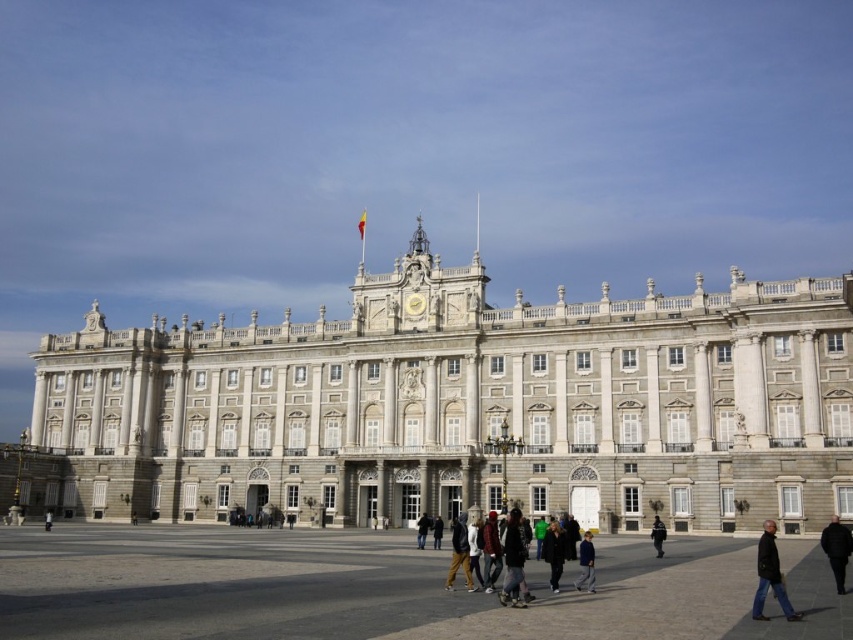
Question: Among these points, which one is nearest to the camera?

Choices:
 (A) (231, 397)
 (B) (757, 561)

Answer: (B)

Question: Can you confirm if gray concrete plaza at lower center is positioned to the left of dark blue jacket at center?

Choices:
 (A) no
 (B) yes

Answer: (B)

Question: Does light blue denim jacket at center have a greater width compared to dark blue uniform at center?

Choices:
 (A) yes
 (B) no

Answer: (A)

Question: Is the position of brown cotton pants at center less distant than that of light blue denim jacket at center?

Choices:
 (A) no
 (B) yes

Answer: (A)

Question: Which is nearer to the black leather jacket at lower right?

Choices:
 (A) dark blue uniform at center
 (B) white stone building at center
 (C) gray concrete plaza at lower center

Answer: (A)

Question: Which of the following is the closest to the observer?

Choices:
 (A) dark gray hoodie at center
 (B) gray concrete plaza at lower center
 (C) brown cotton pants at center
 (D) white stone building at center

Answer: (B)